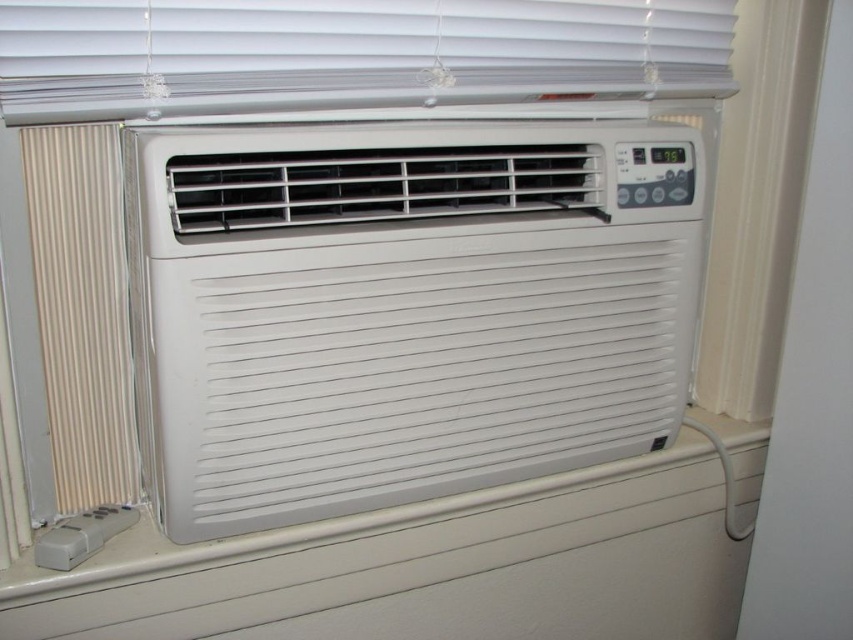
Question: Does white plastic air conditioner at center come behind white plastic blinds at upper center?

Choices:
 (A) yes
 (B) no

Answer: (A)

Question: Can you confirm if white plastic air conditioner at center is smaller than white plastic blinds at upper center?

Choices:
 (A) no
 (B) yes

Answer: (A)

Question: Considering the real-world distances, which object is closest to the white plastic air conditioner at center?

Choices:
 (A) white plastic blinds at upper center
 (B) metallic silver radiator at left
 (C) white plastic thermostat at center

Answer: (A)

Question: Which of the following is the closest to the observer?

Choices:
 (A) white plastic air conditioner at center
 (B) white plastic blinds at upper center
 (C) metallic silver radiator at left
 (D) white plastic thermostat at center

Answer: (B)

Question: Which of the following is the closest to the observer?

Choices:
 (A) white plastic air conditioner at center
 (B) metallic silver radiator at left
 (C) white plastic blinds at upper center
 (D) white plastic thermostat at center

Answer: (C)

Question: Does metallic silver radiator at left have a smaller size compared to white plastic thermostat at center?

Choices:
 (A) yes
 (B) no

Answer: (B)